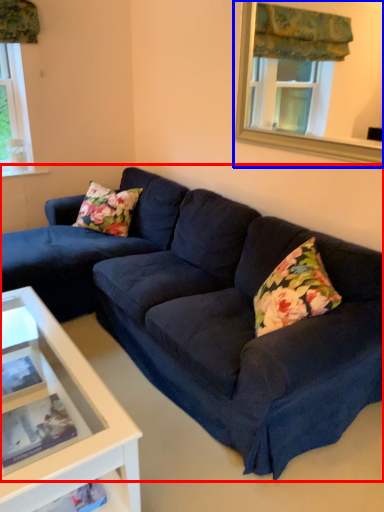
Question: Which of the following is the closest to the observer, studio couch (highlighted by a red box) or window frame (highlighted by a blue box)?

Choices:
 (A) studio couch
 (B) window frame

Answer: (A)